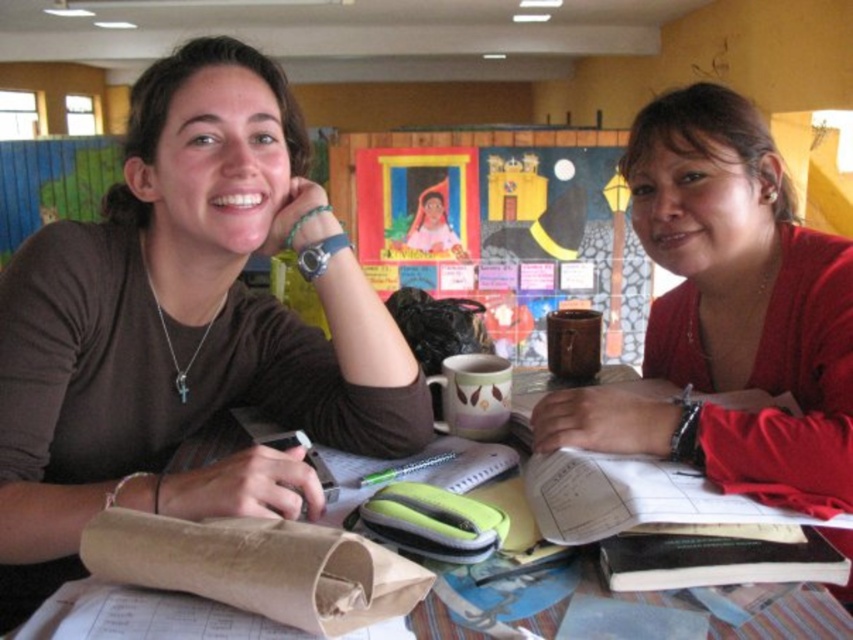
You are a photographer taking a picture of the two people at the table. You notice two points on the table, point (x=282, y=419) and point (x=489, y=301). Which point will appear larger in your photo?

Point (x=282, y=419) is closer to the camera than point (x=489, y=301), so it will appear larger in the photo.

You are standing at the edge of the table and want to place a book exactly between the matte red sweater at center and the edge of the table. What is the coordinate of the point where you should place the book?

The matte red sweater at center is located at point (728, 314). To place the book exactly halfway between the sweater and the edge of the table, calculate the midpoint between these coordinates and the edge. The exact coordinates depend on the table edge position, but the midpoint would be halfway between (728, 314) and the edge point.

You are organizing a clothing donation drive and need to arrange the brown matte shirt at center and the matte red sweater at center on a shelf. According to their positions in the image, which item should be placed to the left of the other?

The brown matte shirt at center should be placed to the left of the matte red sweater at center because in the image, the brown matte shirt at center is positioned on the left side of the matte red sweater at center.